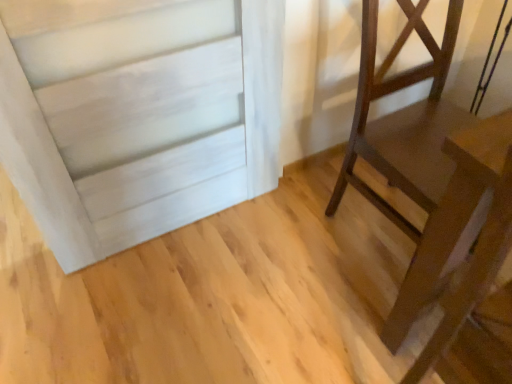
What do you see at coordinates (418, 161) in the screenshot?
I see `dark brown wood chair at right` at bounding box center [418, 161].

Where is `dark brown wood chair at right`? This screenshot has height=384, width=512. dark brown wood chair at right is located at coordinates (418, 161).

At what (x,y) coordinates should I click in order to perform the action: click on wooden table at lower right. Please return your answer as a coordinate pair (x, y). The image size is (512, 384). Looking at the image, I should click on (477, 246).

The image size is (512, 384). Describe the element at coordinates (477, 246) in the screenshot. I see `wooden table at lower right` at that location.

Locate an element on the screen. The width and height of the screenshot is (512, 384). dark brown wood chair at right is located at coordinates (418, 161).

Which object is positioned more to the right, dark brown wood chair at right or wooden table at lower right?

From the viewer's perspective, dark brown wood chair at right appears more on the right side.

Which object is further away from the camera, dark brown wood chair at right or wooden table at lower right?

dark brown wood chair at right is more distant.

Considering the points (420, 266) and (480, 144), which point is in front, point (420, 266) or point (480, 144)?

Point (480, 144)

From the image's perspective, who appears lower, dark brown wood chair at right or wooden table at lower right?

wooden table at lower right.

From a real-world perspective, is dark brown wood chair at right under wooden table at lower right?

Correct, in the physical world, dark brown wood chair at right is lower than wooden table at lower right.

Can you confirm if dark brown wood chair at right is wider than wooden table at lower right?

Yes.

Who is shorter, dark brown wood chair at right or wooden table at lower right?

With less height is dark brown wood chair at right.

Considering the relative sizes of dark brown wood chair at right and wooden table at lower right in the image provided, is dark brown wood chair at right bigger than wooden table at lower right?

Correct, dark brown wood chair at right is larger in size than wooden table at lower right.

Is dark brown wood chair at right surrounding wooden table at lower right?

No, wooden table at lower right is not inside dark brown wood chair at right.

Is dark brown wood chair at right far away from wooden table at lower right?

Actually, dark brown wood chair at right and wooden table at lower right are a little close together.

Looking at this image, could you tell me if dark brown wood chair at right is facing wooden table at lower right?

No.

Measure the distance from dark brown wood chair at right to wooden table at lower right.

The distance of dark brown wood chair at right from wooden table at lower right is 11.55 inches.

Locate an element on the screen. furniture behind the wooden table at lower right is located at coordinates (418, 161).

Which object is positioned more to the right, wooden table at lower right or dark brown wood chair at right?

dark brown wood chair at right.

Is the position of wooden table at lower right more distant than that of dark brown wood chair at right?

No, the depth of wooden table at lower right is less than that of dark brown wood chair at right.

Does point (505, 251) come farther from viewer compared to point (404, 138)?

No.

From the image's perspective, is wooden table at lower right above dark brown wood chair at right?

No, from the image's perspective, wooden table at lower right is not above dark brown wood chair at right.

From a real-world perspective, is wooden table at lower right positioned above or below dark brown wood chair at right?

wooden table at lower right is above dark brown wood chair at right.

Considering the sizes of wooden table at lower right and dark brown wood chair at right in the image, is wooden table at lower right wider or thinner than dark brown wood chair at right?

In the image, wooden table at lower right appears to be more narrow than dark brown wood chair at right.

Which of these two, wooden table at lower right or dark brown wood chair at right, stands taller?

Standing taller between the two is wooden table at lower right.

In the scene shown: Considering the sizes of wooden table at lower right and dark brown wood chair at right in the image, is wooden table at lower right bigger or smaller than dark brown wood chair at right?

Answer: Considering their sizes, wooden table at lower right takes up less space than dark brown wood chair at right.

Which is correct: wooden table at lower right is inside dark brown wood chair at right, or outside of it?

wooden table at lower right is not enclosed by dark brown wood chair at right.

Can you see wooden table at lower right touching dark brown wood chair at right?

No, wooden table at lower right is not making contact with dark brown wood chair at right.

Is wooden table at lower right oriented towards dark brown wood chair at right?

No, wooden table at lower right is not facing towards dark brown wood chair at right.

Can you tell me how much wooden table at lower right and dark brown wood chair at right differ in facing direction?

86.1 degrees separate the facing orientations of wooden table at lower right and dark brown wood chair at right.

In the image, there is a wooden table at lower right. Identify the location of furniture above it (from the image's perspective). (418, 161).

Locate an element on the screen. furniture above the wooden table at lower right (from the image's perspective) is located at coordinates (418, 161).

At what (x,y) coordinates should I click in order to perform the action: click on table in front of the dark brown wood chair at right. Please return your answer as a coordinate pair (x, y). This screenshot has width=512, height=384. Looking at the image, I should click on (477, 246).